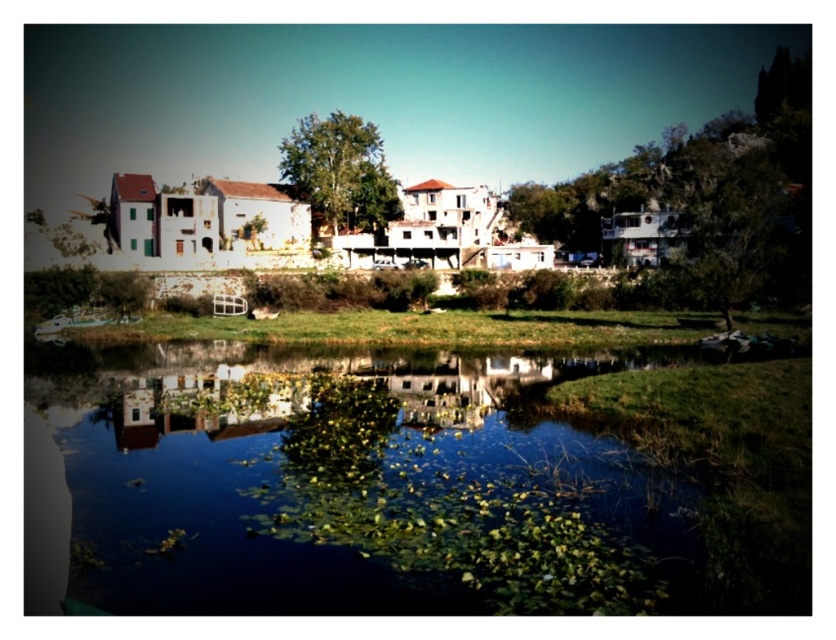
You are standing on the dock and see the green leafy water at center and the green leafy tree at center. Which one is closer to the water surface?

The green leafy water at center is closer to the water surface because it is located below the green leafy tree at center.

You are standing on the dock and see the green leafy water at center and the green leafy tree at center. Which one is located to the right of the other?

The green leafy water at center is positioned on the right side of green leafy tree at center.